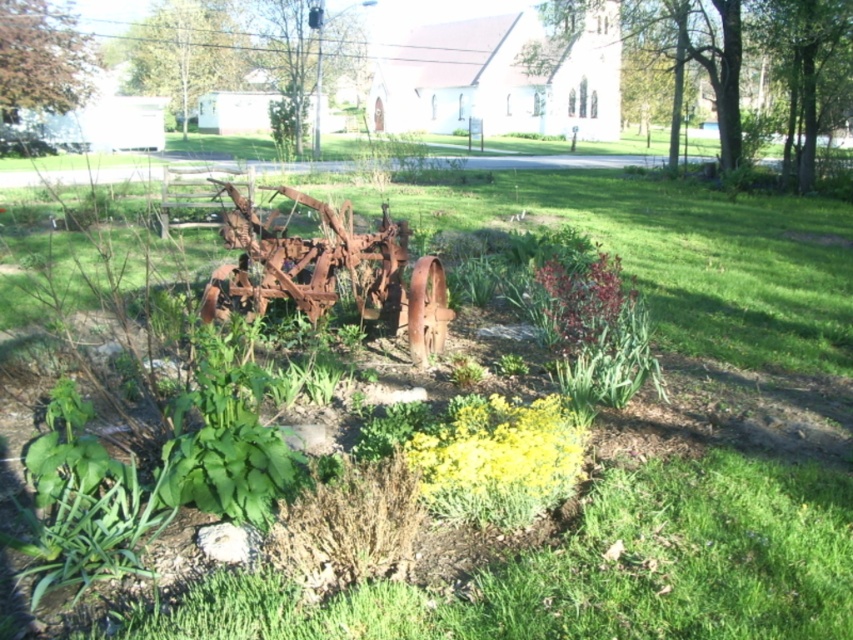
Question: Where is rusty metal tractor at center located in relation to shiny red leaves at center in the image?

Choices:
 (A) above
 (B) below

Answer: (A)

Question: Can you confirm if rusty metal tractor at center is bigger than yellow matte flower at center?

Choices:
 (A) yes
 (B) no

Answer: (A)

Question: Considering the real-world distances, which object is closest to the rusty metal tractor at center?

Choices:
 (A) yellow matte flower at center
 (B) shiny red leaves at center

Answer: (B)

Question: Which of the following is the farthest from the observer?

Choices:
 (A) (430, 307)
 (B) (618, 314)

Answer: (A)

Question: Which point is closer to the camera taking this photo?

Choices:
 (A) (297, 280)
 (B) (554, 273)
 (C) (437, 472)

Answer: (C)

Question: Does yellow matte flower at center appear under shiny red leaves at center?

Choices:
 (A) yes
 (B) no

Answer: (A)